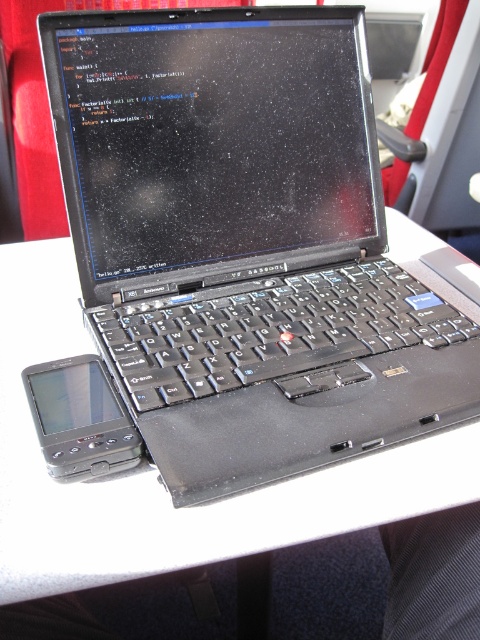
Is black matte laptop at center below black plastic smartphone at lower left?

Incorrect, black matte laptop at center is not positioned below black plastic smartphone at lower left.

Describe the element at coordinates (243, 243) in the screenshot. I see `black matte laptop at center` at that location.

Is point (265, 182) positioned before point (96, 465)?

No, it is not.

You are a GUI agent. You are given a task and a screenshot of the screen. Output one action in this format:
    pyautogui.click(x=<x>, y=<y>)
    Task: Click on the black matte laptop at center
    Image resolution: width=480 pixels, height=640 pixels.
    Given the screenshot: What is the action you would take?
    pyautogui.click(x=243, y=243)

In the scene shown: Does white plastic table at center appear under black plastic smartphone at lower left?

No.

Does white plastic table at center have a smaller size compared to black plastic smartphone at lower left?

Incorrect, white plastic table at center is not smaller in size than black plastic smartphone at lower left.

Is point (38, 449) farther from camera compared to point (76, 458)?

Yes, point (38, 449) is behind point (76, 458).

Locate an element on the screen. white plastic table at center is located at coordinates (157, 470).

Can you confirm if black matte laptop at center is positioned to the right of white plastic table at center?

Correct, you'll find black matte laptop at center to the right of white plastic table at center.

Who is positioned more to the left, black matte laptop at center or white plastic table at center?

Positioned to the left is white plastic table at center.

Where is `black matte laptop at center`? The height and width of the screenshot is (640, 480). black matte laptop at center is located at coordinates (243, 243).

You are a GUI agent. You are given a task and a screenshot of the screen. Output one action in this format:
    pyautogui.click(x=<x>, y=<y>)
    Task: Click on the black matte laptop at center
    The image size is (480, 640).
    Given the screenshot: What is the action you would take?
    pyautogui.click(x=243, y=243)